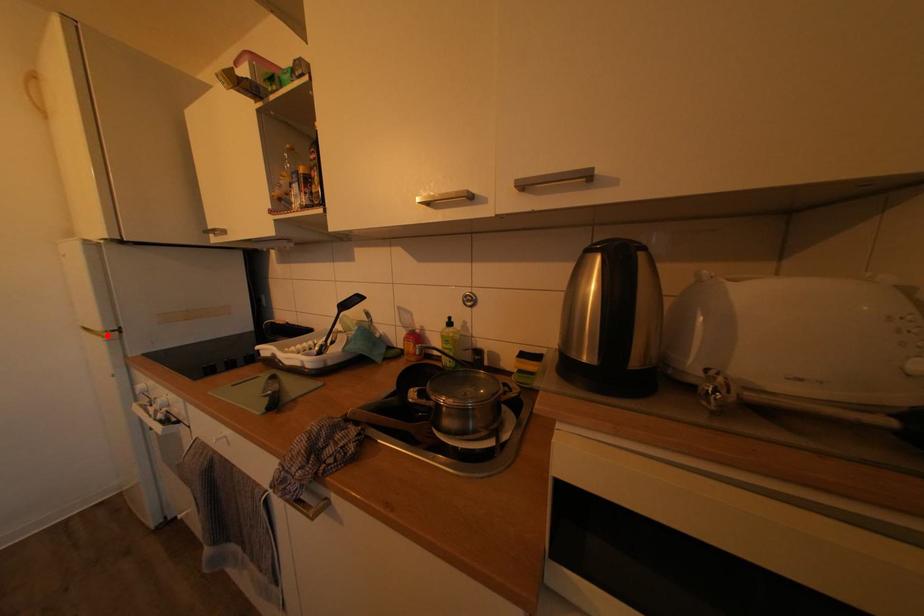
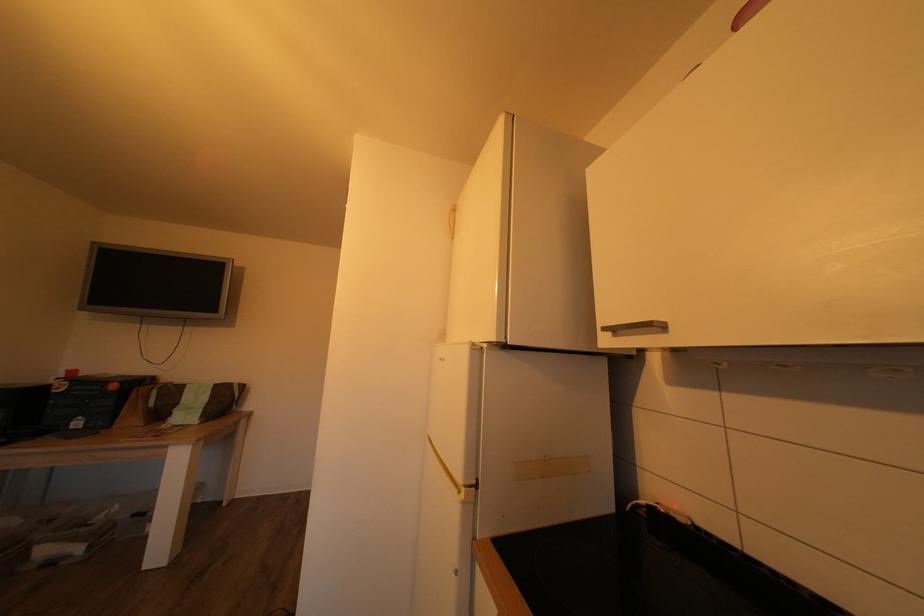
Where in the second image is the point corresponding to the highlighted location from the first image?

(468, 487)